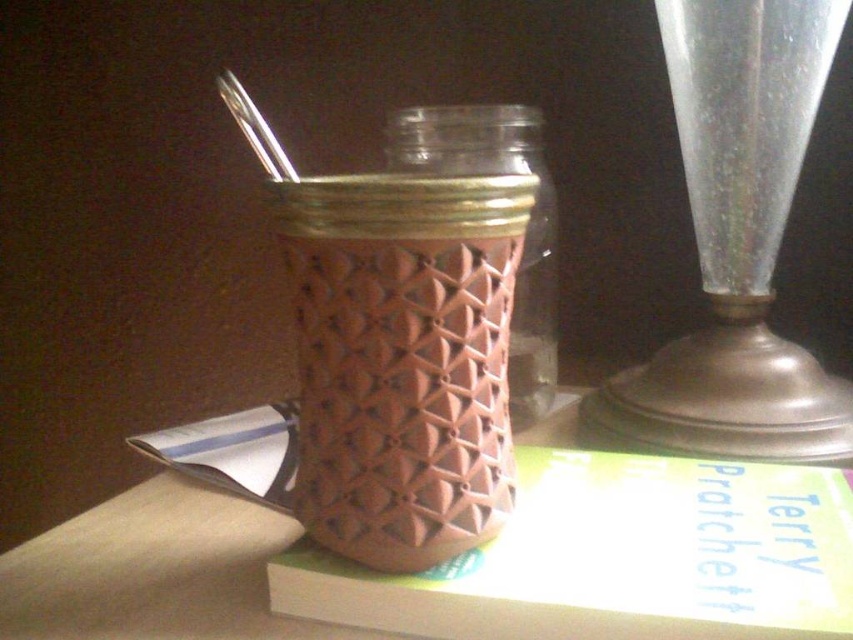
You have two vases in the scene. The transparent glass vase at right and the brown textured vase at center. Which one is taller?

The transparent glass vase at right is taller than the brown textured vase at center.

You are organizing a shelf and need to place both the brown textured vase at center and the pink textured glass jar at center. If you want to place the smaller one on top to prevent it from tipping over, which object should you choose?

The brown textured vase at center has a smaller size compared to the pink textured glass jar at center, so you should place the brown textured vase at center on top to prevent it from tipping over.